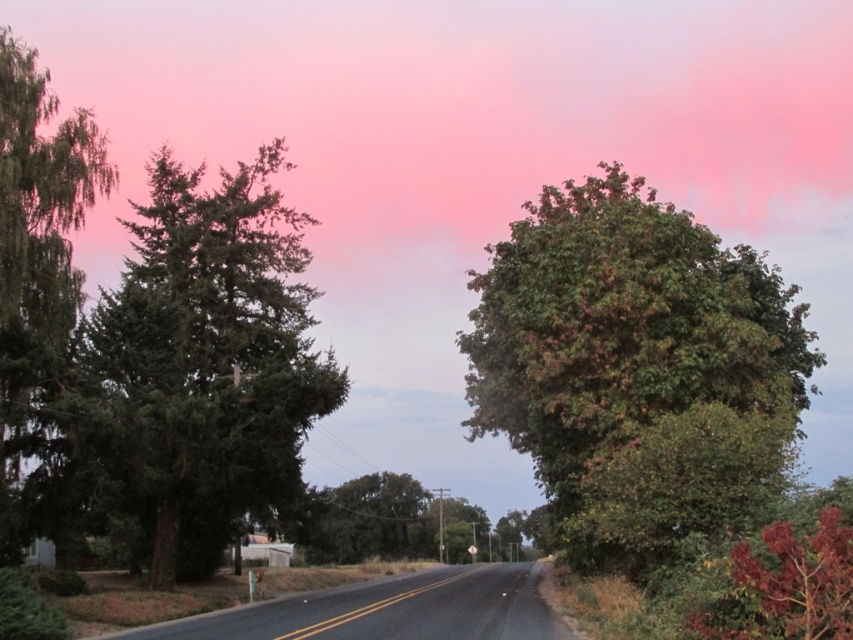
Is green matte tree at left taller than green leafy tree at center?

Yes.

Locate an element on the screen. This screenshot has height=640, width=853. green matte tree at left is located at coordinates (199, 371).

Image resolution: width=853 pixels, height=640 pixels. What are the coordinates of `green matte tree at left` in the screenshot? It's located at (199, 371).

In the scene shown: Does green leafy tree at right have a lesser height compared to green matte tree at left?

Indeed, green leafy tree at right has a lesser height compared to green matte tree at left.

Who is higher up, green leafy tree at right or green matte tree at left?

Positioned higher is green matte tree at left.

What do you see at coordinates (636, 371) in the screenshot? The image size is (853, 640). I see `green leafy tree at right` at bounding box center [636, 371].

Locate an element on the screen. The height and width of the screenshot is (640, 853). green leafy tree at right is located at coordinates (636, 371).

Can you confirm if green leafy tree at right is bigger than green leafy tree at center?

Indeed, green leafy tree at right has a larger size compared to green leafy tree at center.

The height and width of the screenshot is (640, 853). In order to click on green leafy tree at right in this screenshot , I will do `click(636, 371)`.